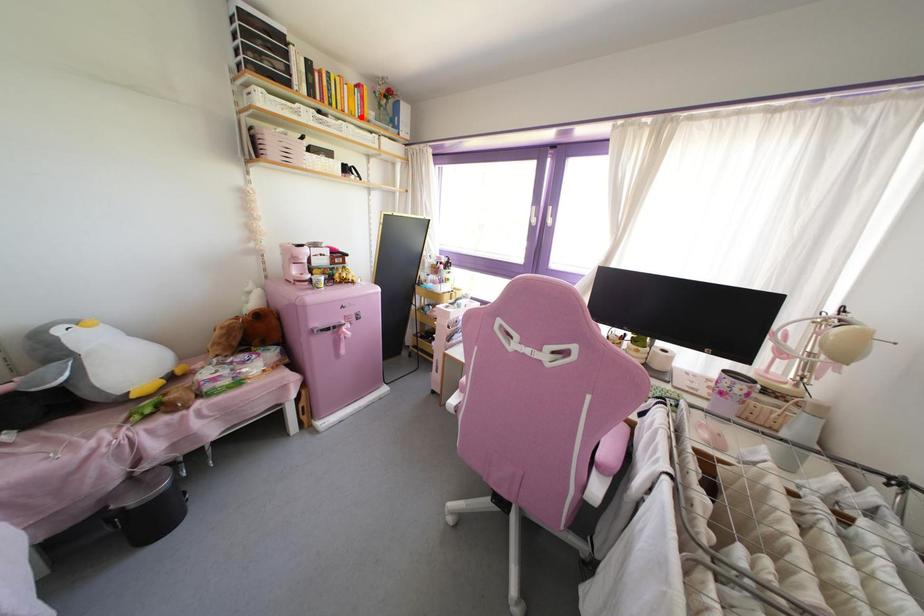
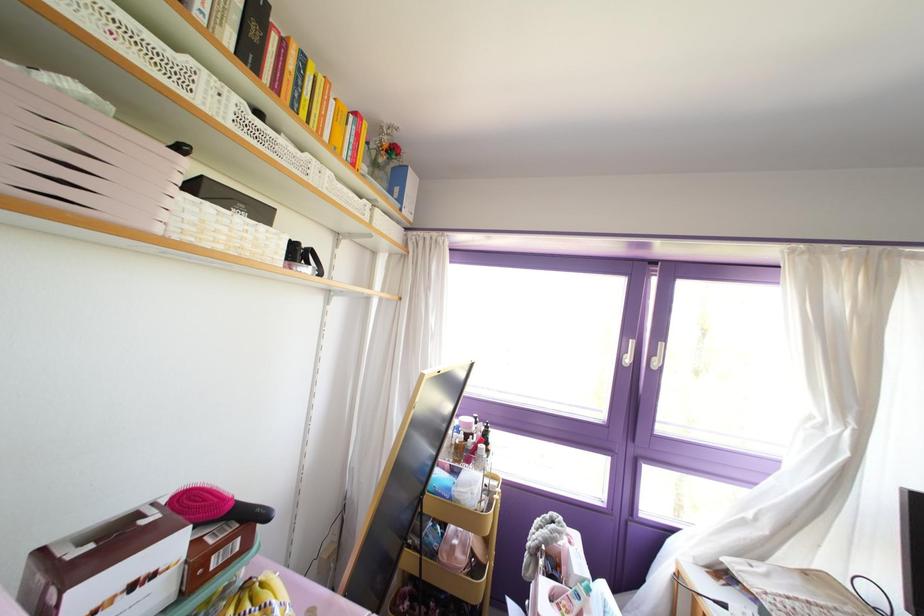
Locate, in the second image, the point that corresponds to the highlighted location in the first image.

(351, 164)